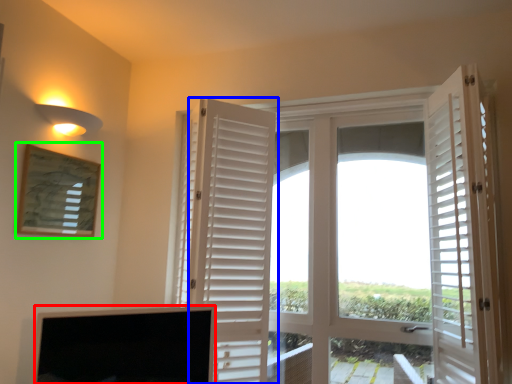
Question: Which object is the farthest from screen (highlighted by a red box)? Choose among these: door (highlighted by a blue box) or picture frame (highlighted by a green box).

Choices:
 (A) door
 (B) picture frame

Answer: (B)